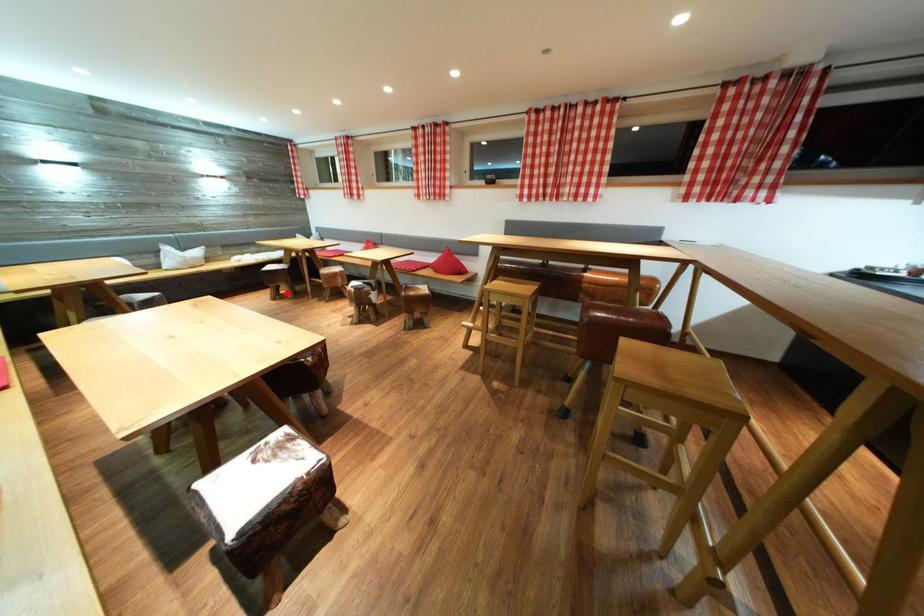
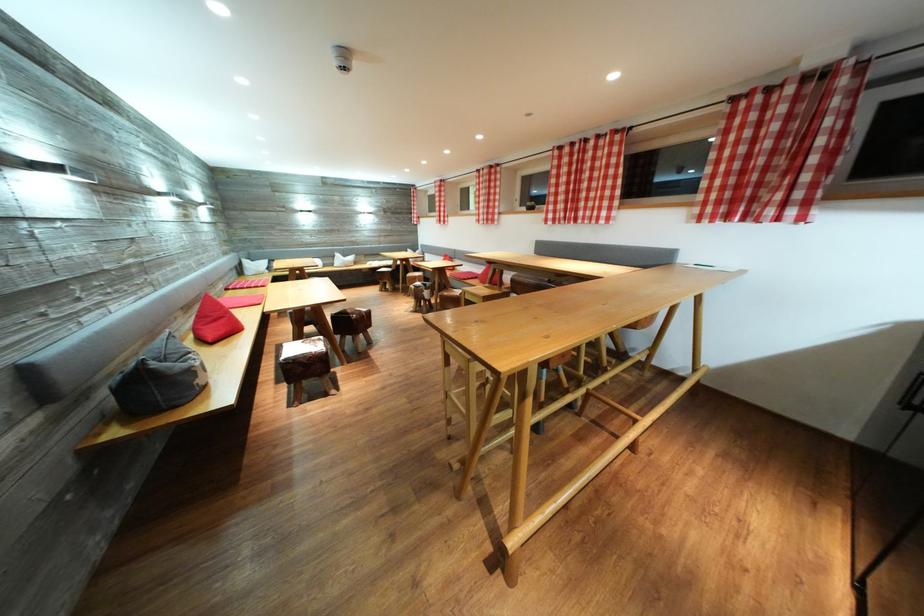
Locate, in the second image, the point that corresponds to the highlighted location in the first image.

(393, 289)